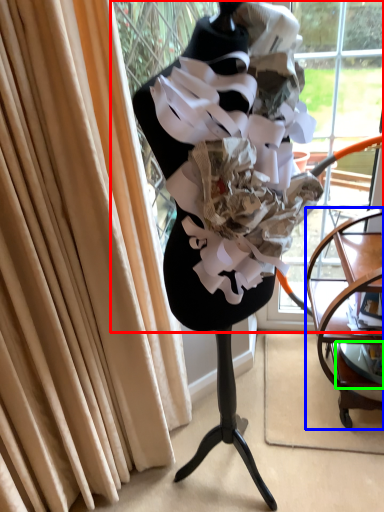
Question: Considering the real-world distances, which object is farthest from shop window (highlighted by a red box)? furniture (highlighted by a blue box) or shelf (highlighted by a green box)?

Choices:
 (A) furniture
 (B) shelf

Answer: (B)